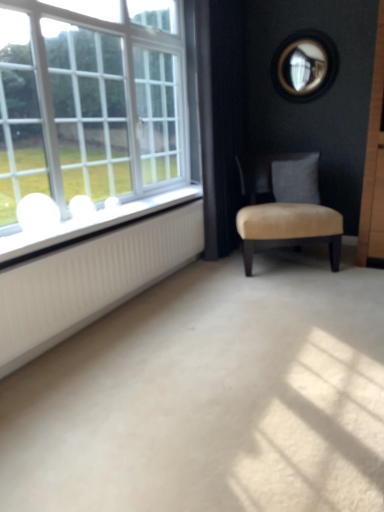
Question: From the image's perspective, is beige velvet chair at center located beneath white ribbed radiator at left?

Choices:
 (A) yes
 (B) no

Answer: (B)

Question: Considering the relative sizes of beige velvet chair at center and white ribbed radiator at left in the image provided, is beige velvet chair at center smaller than white ribbed radiator at left?

Choices:
 (A) no
 (B) yes

Answer: (A)

Question: From a real-world perspective, is beige velvet chair at center on top of white ribbed radiator at left?

Choices:
 (A) no
 (B) yes

Answer: (B)

Question: Is beige velvet chair at center thinner than white ribbed radiator at left?

Choices:
 (A) yes
 (B) no

Answer: (B)

Question: Is beige velvet chair at center positioned with its back to white ribbed radiator at left?

Choices:
 (A) yes
 (B) no

Answer: (B)

Question: Is white glossy window sill at left inside or outside of white glass window at left?

Choices:
 (A) outside
 (B) inside

Answer: (A)

Question: From a real-world perspective, is white glossy window sill at left physically located above or below white glass window at left?

Choices:
 (A) below
 (B) above

Answer: (A)

Question: From their relative heights in the image, would you say white glossy window sill at left is taller or shorter than white glass window at left?

Choices:
 (A) short
 (B) tall

Answer: (A)

Question: From the image's perspective, is white glossy window sill at left located above or below white glass window at left?

Choices:
 (A) above
 (B) below

Answer: (B)

Question: Is white glass window at left wider or thinner than white glossy window sill at left?

Choices:
 (A) wide
 (B) thin

Answer: (A)

Question: Based on their positions, is white glass window at left located to the left or right of white glossy window sill at left?

Choices:
 (A) right
 (B) left

Answer: (B)

Question: Considering the positions of white glass window at left and white glossy window sill at left in the image, is white glass window at left taller or shorter than white glossy window sill at left?

Choices:
 (A) short
 (B) tall

Answer: (B)

Question: From a real-world perspective, relative to white glossy window sill at left, is white glass window at left vertically above or below?

Choices:
 (A) above
 (B) below

Answer: (A)

Question: From their relative heights in the image, would you say white ribbed radiator at left is taller or shorter than white glossy window sill at left?

Choices:
 (A) tall
 (B) short

Answer: (A)

Question: Relative to white glossy window sill at left, is white ribbed radiator at left in front or behind?

Choices:
 (A) front
 (B) behind

Answer: (A)